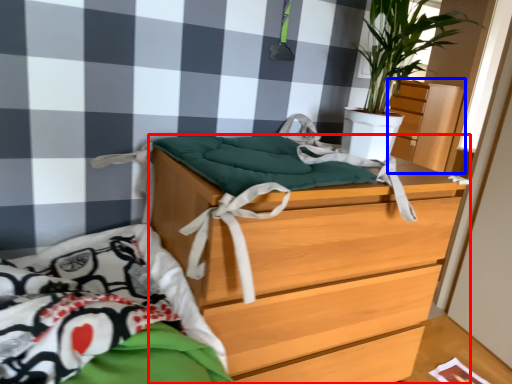
Question: Which point is closer to the camera, chest of drawers (highlighted by a red box) or dresser (highlighted by a blue box)?

Choices:
 (A) chest of drawers
 (B) dresser

Answer: (A)